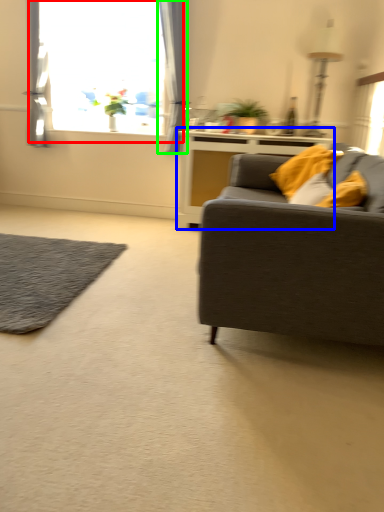
Question: Estimate the real-world distances between objects in this image. Which object is farther from window (highlighted by a red box), table (highlighted by a blue box) or curtain (highlighted by a green box)?

Choices:
 (A) table
 (B) curtain

Answer: (A)